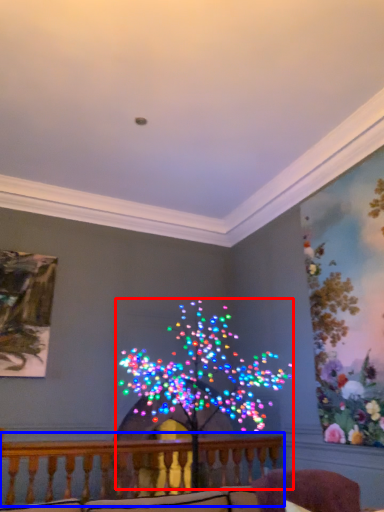
Question: Among these objects, which one is nearest to the camera, christmas decoration (highlighted by a red box) or balcony (highlighted by a blue box)?

Choices:
 (A) christmas decoration
 (B) balcony

Answer: (A)